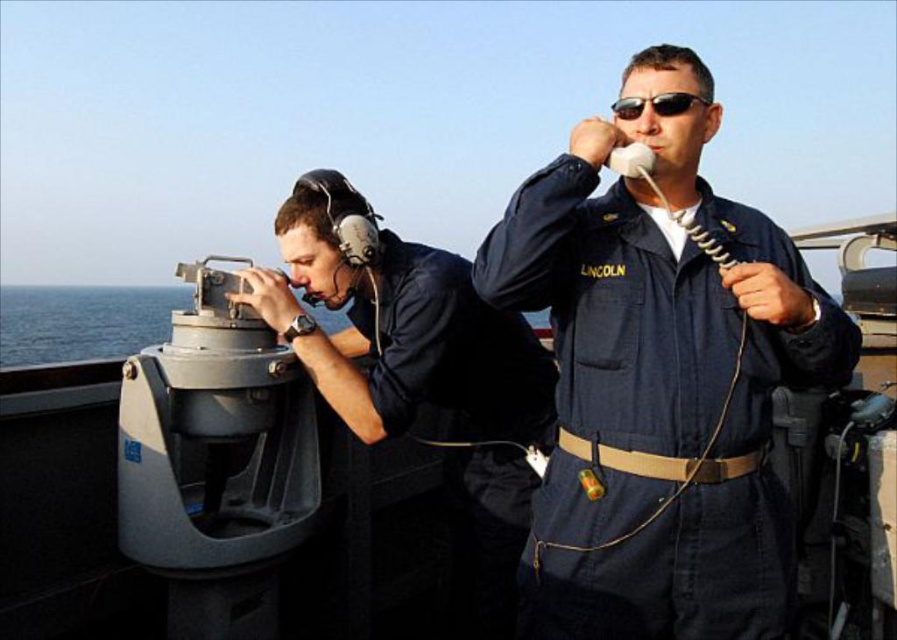
Question: Among these points, which one is farthest from the camera?

Choices:
 (A) (621, 561)
 (B) (546, 355)

Answer: (B)

Question: Is navy blue uniform at center to the left of matte black headset at left from the viewer's perspective?

Choices:
 (A) yes
 (B) no

Answer: (B)

Question: Which point is closer to the camera?

Choices:
 (A) matte black headset at left
 (B) navy blue uniform at center

Answer: (B)

Question: Is navy blue uniform at center smaller than matte black headset at left?

Choices:
 (A) no
 (B) yes

Answer: (B)

Question: Does navy blue uniform at center appear on the right side of matte black headset at left?

Choices:
 (A) no
 (B) yes

Answer: (B)